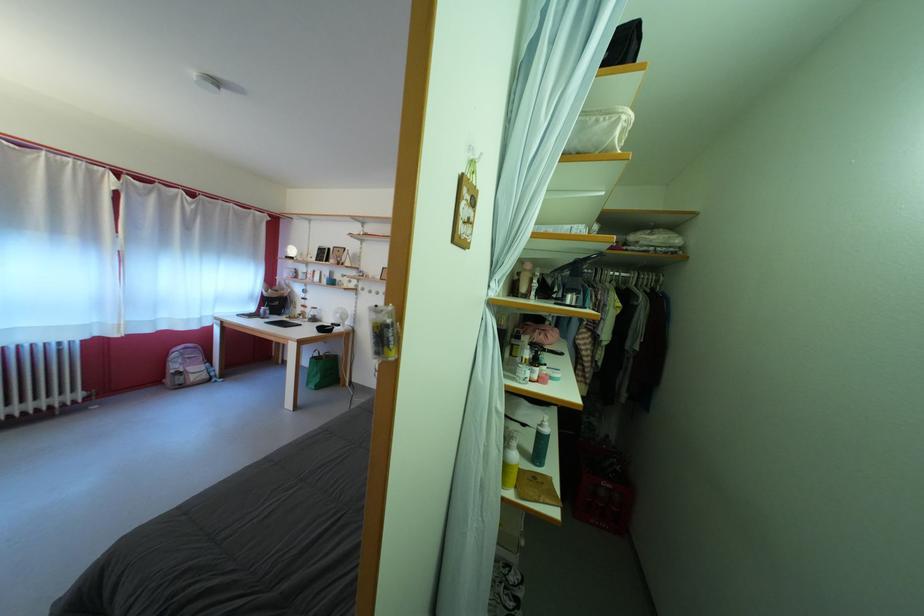
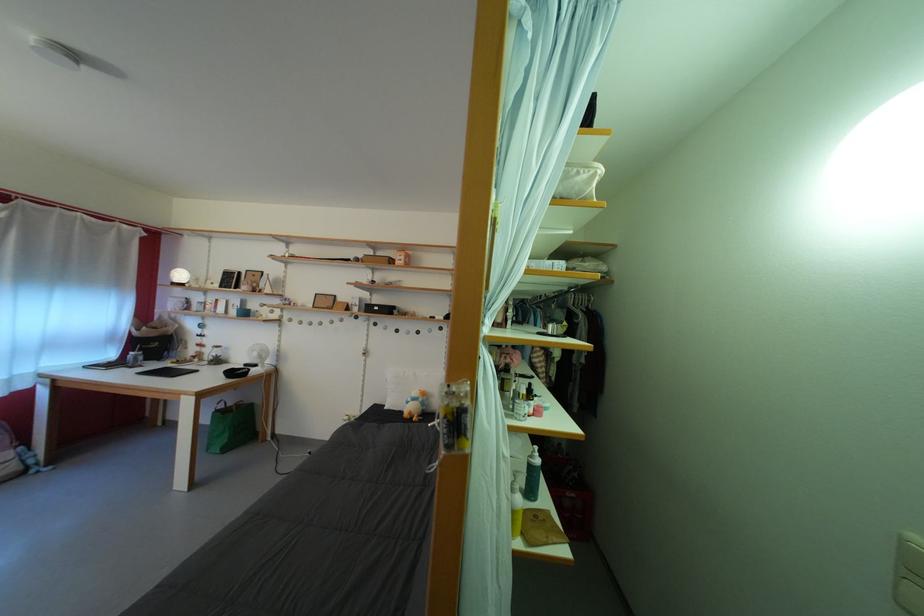
Find the pixel in the second image that matches (605,128) in the first image.

(587, 179)